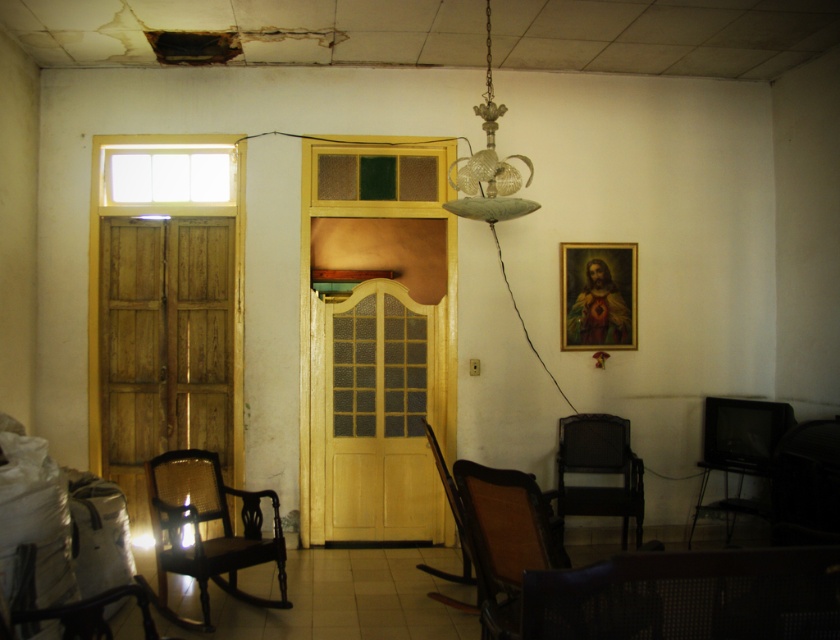
Identify the location of dark brown cane armchair at left. (198, 531).

Which is in front, point (140, 580) or point (617, 246)?

Point (140, 580) is more forward.

Is point (177, 525) behind point (599, 266)?

That is False.

Where is `dark brown cane armchair at left`? dark brown cane armchair at left is located at coordinates (198, 531).

Can you confirm if wooden door at center is shorter than dark brown woven armchair at center?

Incorrect, wooden door at center's height does not fall short of dark brown woven armchair at center's.

Between wooden door at center and dark brown woven armchair at center, which one is positioned higher?

wooden door at center is higher up.

At what (x,y) coordinates should I click in order to perform the action: click on wooden door at center. Please return your answer as a coordinate pair (x, y). Image resolution: width=840 pixels, height=640 pixels. Looking at the image, I should click on (378, 417).

Looking at this image, can you confirm if wooden door at center is positioned to the left of woven brown armchair at lower right?

Correct, you'll find wooden door at center to the left of woven brown armchair at lower right.

Who is higher up, wooden door at center or woven brown armchair at lower right?

Positioned higher is wooden door at center.

Which is in front, point (324, 374) or point (497, 481)?

Point (497, 481) is more forward.

At what (x,y) coordinates should I click in order to perform the action: click on wooden door at center. Please return your answer as a coordinate pair (x, y). Looking at the image, I should click on (378, 417).